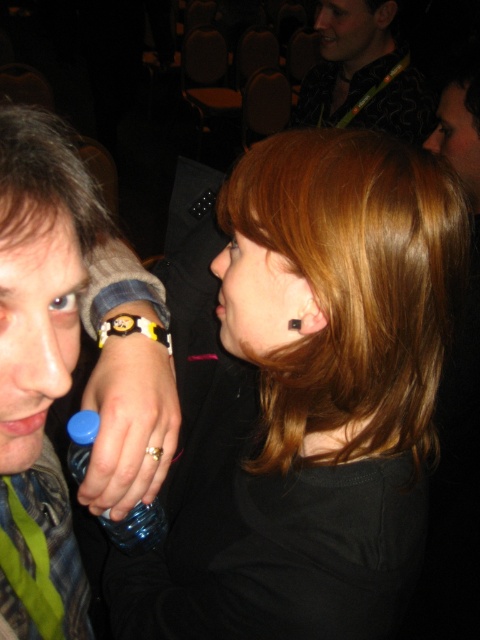
Does point (47, 237) come closer to viewer compared to point (361, 10)?

Yes, it is.

Is point (71, 337) positioned after point (340, 13)?

No, it is not.

Locate an element on the screen. This screenshot has height=640, width=480. matte yellow bracelet at upper left is located at coordinates (36, 332).

Find the location of a particular element. This screenshot has width=480, height=640. matte black ear at center is located at coordinates (309, 400).

Does matte black ear at center have a smaller size compared to gold metallic ring at lower center?

Actually, matte black ear at center might be larger than gold metallic ring at lower center.

Does point (312, 225) lie behind point (103, 401)?

No, (312, 225) is in front of (103, 401).

Locate an element on the screen. The width and height of the screenshot is (480, 640). matte black ear at center is located at coordinates (309, 400).

Does point (215, 374) lie in front of point (271, 289)?

That is False.

Is matte black ear at center further to camera compared to black matte earrings at center?

No, it is in front of black matte earrings at center.

Describe the element at coordinates (309, 400) in the screenshot. I see `matte black ear at center` at that location.

You are a GUI agent. You are given a task and a screenshot of the screen. Output one action in this format:
    pyautogui.click(x=<x>, y=<y>)
    Task: Click on the matte black ear at center
    The image size is (480, 640).
    Given the screenshot: What is the action you would take?
    pyautogui.click(x=309, y=400)